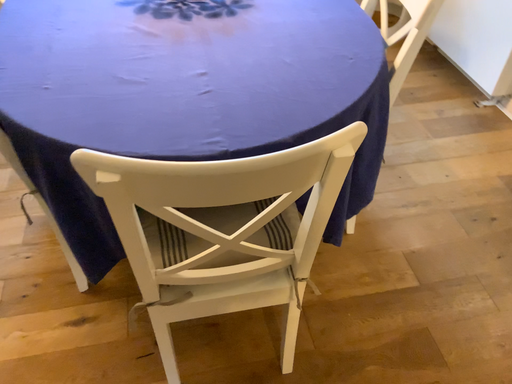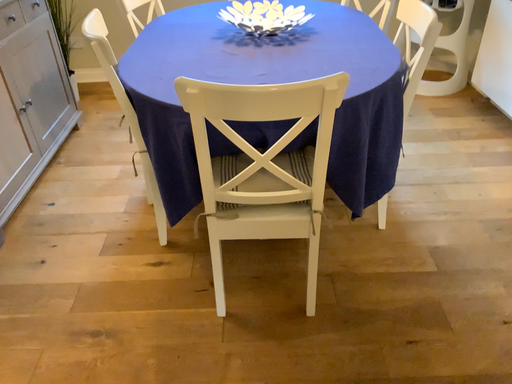
Question: How did the camera likely rotate when shooting the video?

Choices:
 (A) rotated upward
 (B) rotated downward

Answer: (A)